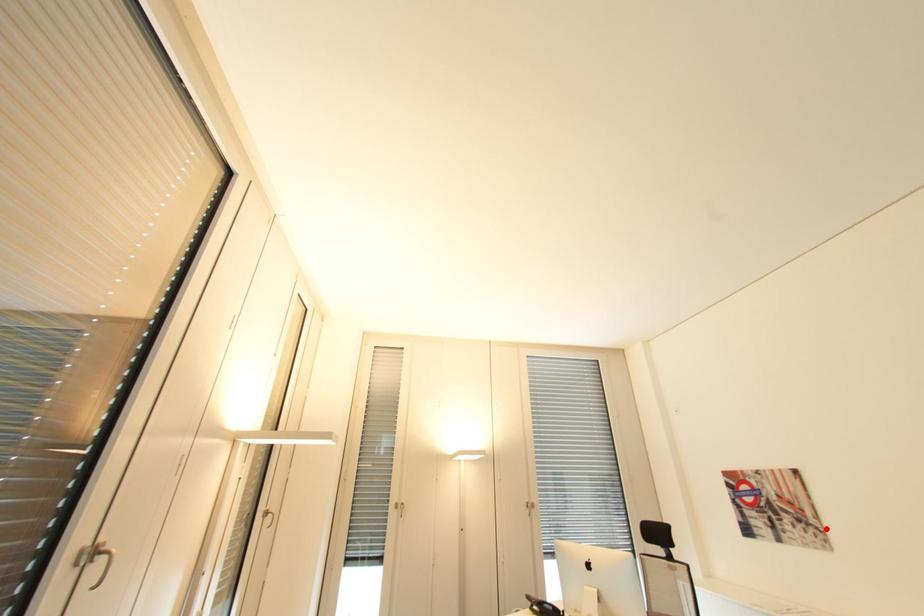
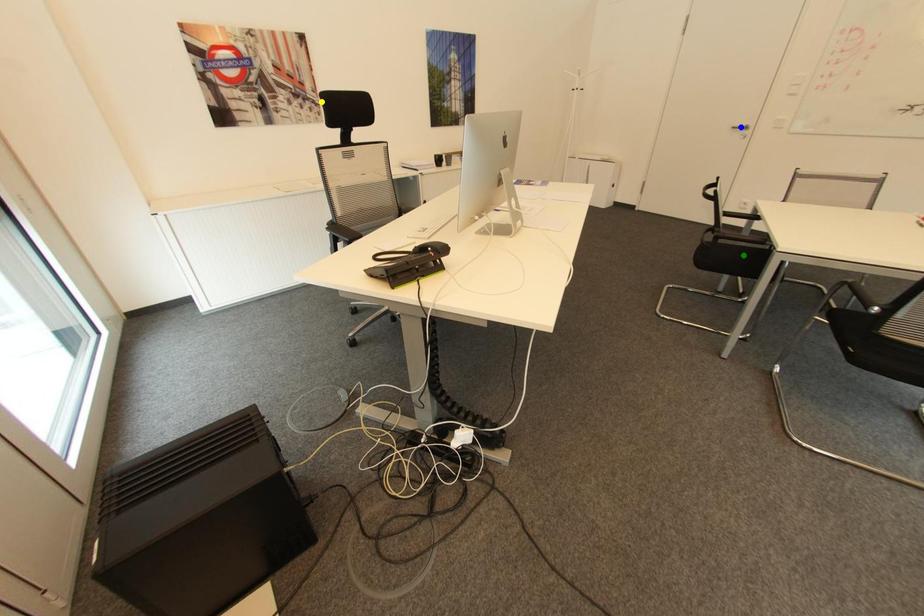
Question: I am providing you with two images of the same scene from different viewpoints. A red point is marked on the first image. You are given multiple points on the second image. Which spot in image 2 lines up with the point in image 1?

Choices:
 (A) blue point
 (B) green point
 (C) yellow point

Answer: (C)